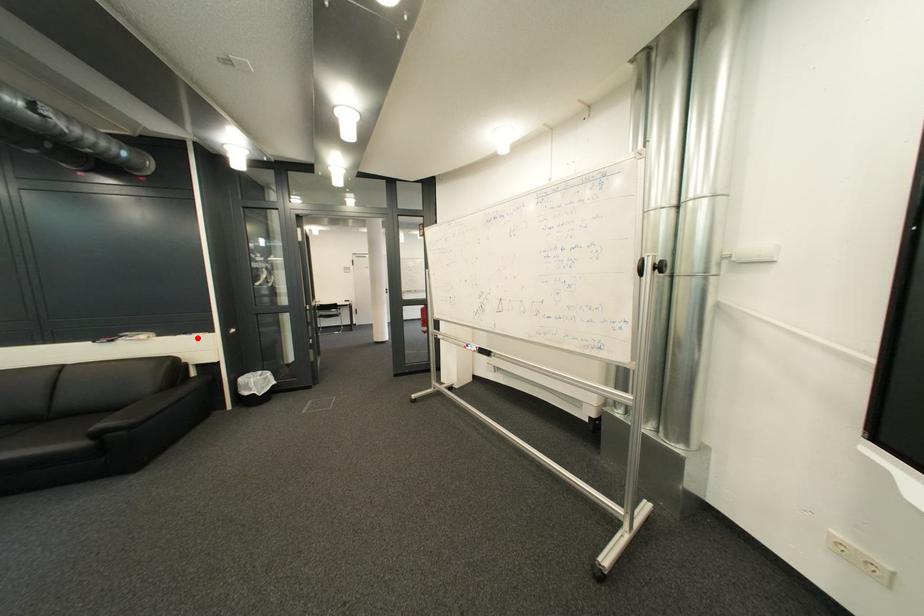
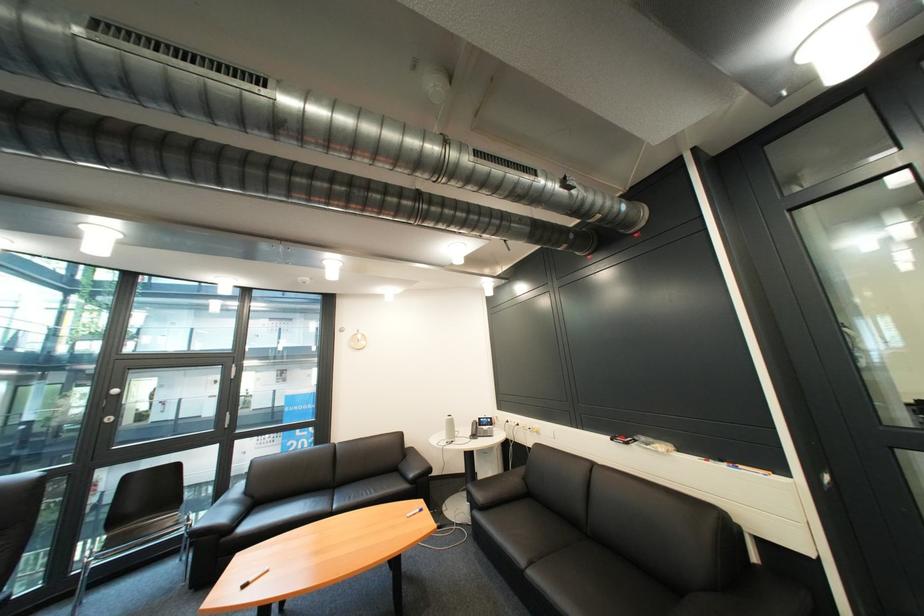
Where in the second image is the point corresponding to the highlighted location from the first image?

(736, 468)